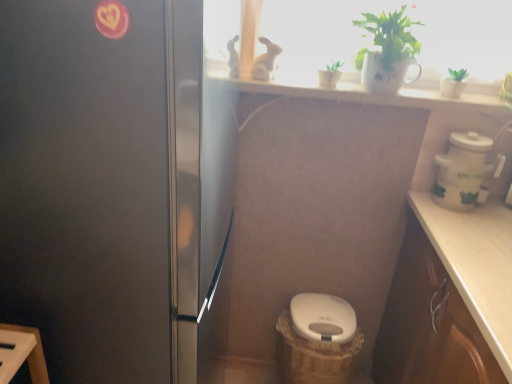
Question: From the image's perspective, is green matte plant at upper right, positioned as the first houseplant in right-to-left order, located above or below white ceramic pot at right?

Choices:
 (A) below
 (B) above

Answer: (B)

Question: In the image, is green matte plant at upper right, positioned as the first houseplant in right-to-left order, positioned in front of or behind white ceramic pot at right?

Choices:
 (A) front
 (B) behind

Answer: (B)

Question: Which is nearer to the green matte plant at upper center, acting as the first houseplant starting from the left?

Choices:
 (A) green matte plant at upper right, which is the third houseplant in left-to-right order
 (B) white ceramic mug at upper center, which ranks as the second houseplant in left-to-right order
 (C) white glossy toilet bowl at center
 (D) white ceramic pot at right
 (E) satin black fridge at left

Answer: (B)

Question: Which object is positioned farthest from the white glossy toilet bowl at center?

Choices:
 (A) green matte plant at upper right, positioned as the first houseplant in right-to-left order
 (B) white ceramic mug at upper center, marked as the 2th houseplant in a right-to-left arrangement
 (C) brown woven basket at lower center
 (D) green matte plant at upper center, acting as the first houseplant starting from the left
 (E) satin black fridge at left

Answer: (E)